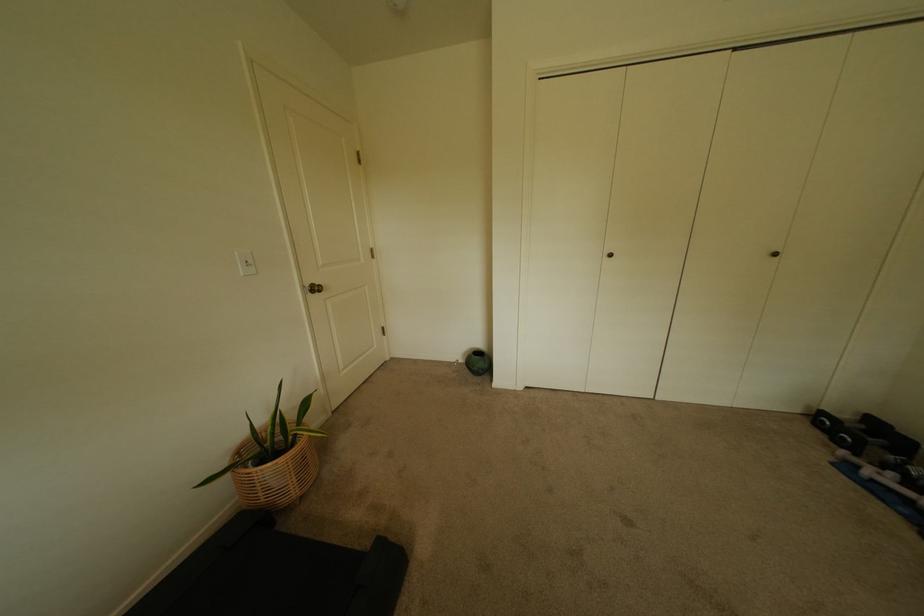
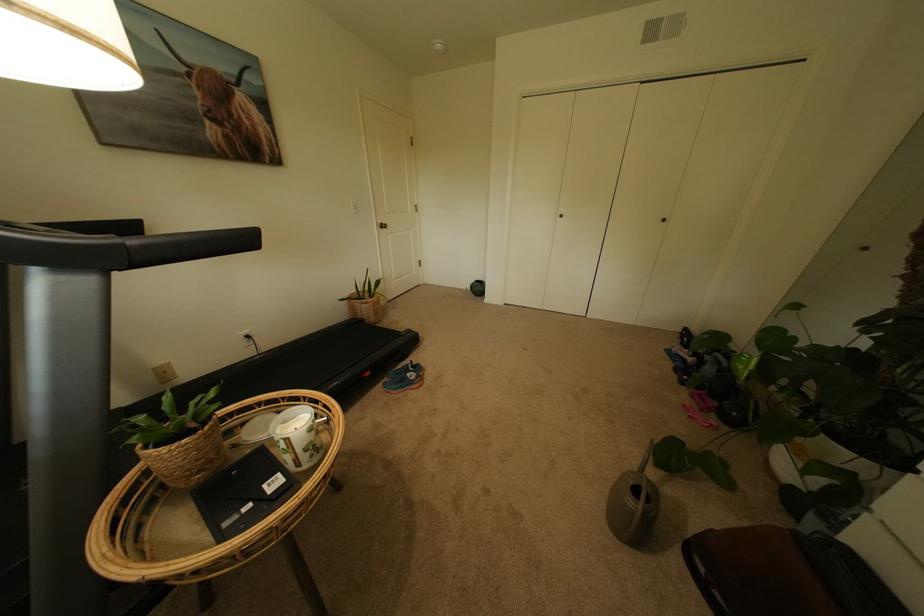
In a continuous first-person perspective shot, in which direction is the camera moving?

The cameraman walked toward right, backward.